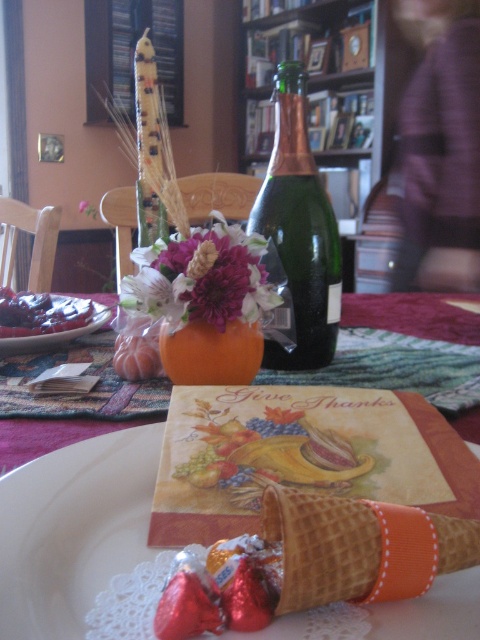
You are setting up a Thanksgiving table and have placed a matte orange vase at center and matte plastic grapes at left. According to the scene, which object is positioned to the right of the other?

The matte orange vase at center is to the right of the matte plastic grapes at left.